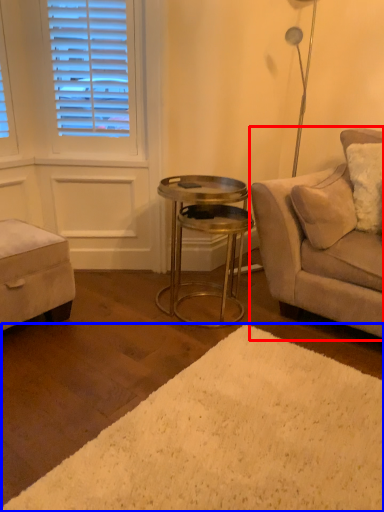
Question: Which point is closer to the camera, studio couch (highlighted by a red box) or plain (highlighted by a blue box)?

Choices:
 (A) studio couch
 (B) plain

Answer: (B)